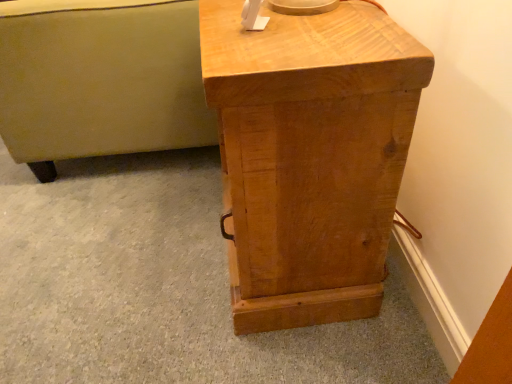
Question: Is matte beige ottoman at left taller or shorter than light brown wood nightstand at center?

Choices:
 (A) short
 (B) tall

Answer: (A)

Question: In terms of size, does matte beige ottoman at left appear bigger or smaller than light brown wood nightstand at center?

Choices:
 (A) big
 (B) small

Answer: (A)

Question: From a real-world perspective, is matte beige ottoman at left positioned above or below light brown wood nightstand at center?

Choices:
 (A) above
 (B) below

Answer: (B)

Question: Choose the correct answer: Is light brown wood nightstand at center inside matte beige ottoman at left or outside it?

Choices:
 (A) outside
 (B) inside

Answer: (A)

Question: In terms of width, does light brown wood nightstand at center look wider or thinner when compared to matte beige ottoman at left?

Choices:
 (A) wide
 (B) thin

Answer: (B)

Question: In terms of size, does light brown wood nightstand at center appear bigger or smaller than matte beige ottoman at left?

Choices:
 (A) small
 (B) big

Answer: (A)

Question: In the image, is light brown wood nightstand at center on the left side or the right side of matte beige ottoman at left?

Choices:
 (A) right
 (B) left

Answer: (A)